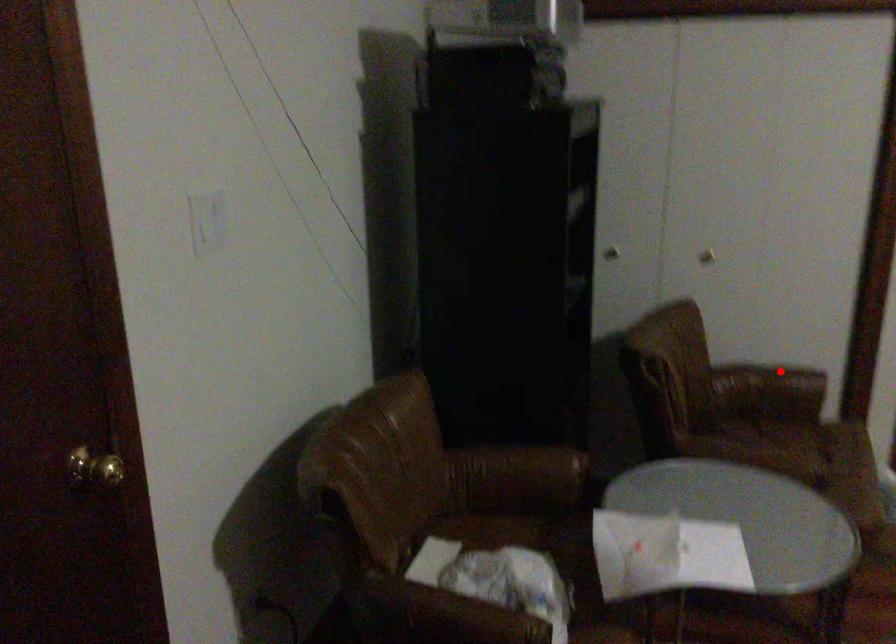
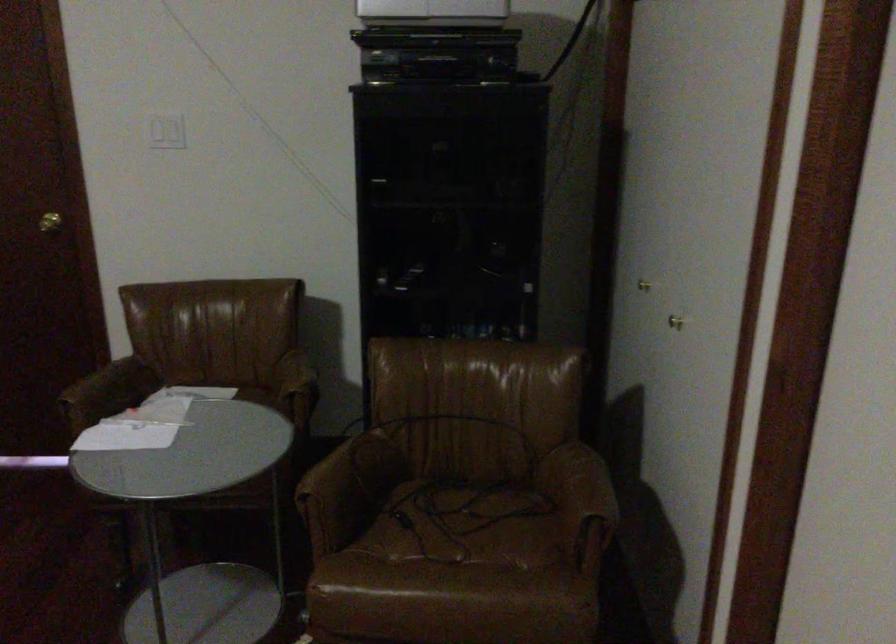
Find the pixel in the second image that matches the highlighted location in the first image.

(582, 485)